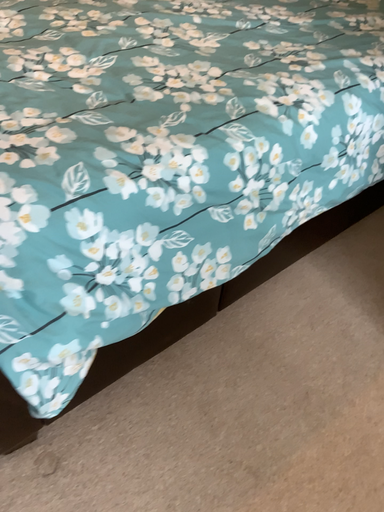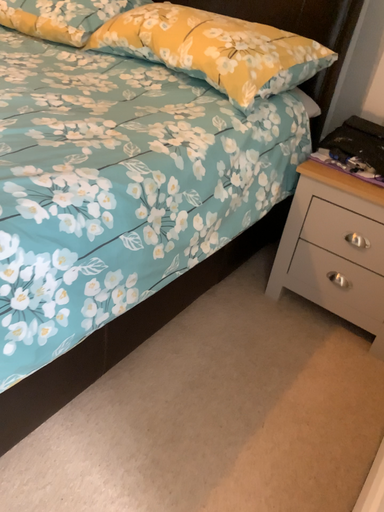
Question: Which way did the camera rotate in the video?

Choices:
 (A) rotated left
 (B) rotated right

Answer: (B)